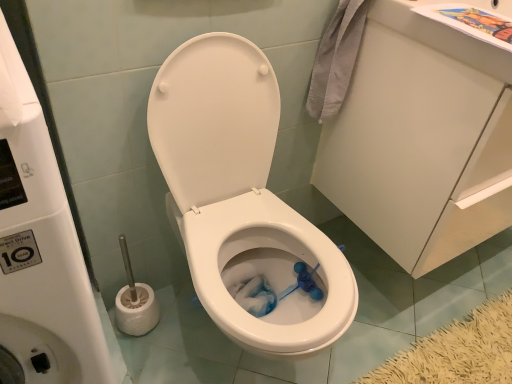
Question: From the image's perspective, is white glossy toilet at center located beneath white glossy water tank at upper center?

Choices:
 (A) no
 (B) yes

Answer: (A)

Question: Considering the relative sizes of white glossy toilet at center and white glossy water tank at upper center in the image provided, is white glossy toilet at center taller than white glossy water tank at upper center?

Choices:
 (A) no
 (B) yes

Answer: (A)

Question: Is white glossy toilet at center oriented away from white glossy water tank at upper center?

Choices:
 (A) no
 (B) yes

Answer: (A)

Question: Can we say white glossy toilet at center lies outside white glossy water tank at upper center?

Choices:
 (A) yes
 (B) no

Answer: (A)

Question: From the image's perspective, is white glossy toilet at center located above white glossy water tank at upper center?

Choices:
 (A) no
 (B) yes

Answer: (B)

Question: Considering the relative positions of white glossy cabinet at upper right and white glossy water tank at upper center in the image provided, is white glossy cabinet at upper right to the left or to the right of white glossy water tank at upper center?

Choices:
 (A) right
 (B) left

Answer: (A)

Question: Looking at the image, does white glossy cabinet at upper right seem bigger or smaller compared to white glossy water tank at upper center?

Choices:
 (A) small
 (B) big

Answer: (B)

Question: Considering their positions, is white glossy cabinet at upper right located in front of or behind white glossy water tank at upper center?

Choices:
 (A) front
 (B) behind

Answer: (B)

Question: From a real-world perspective, is white glossy cabinet at upper right above or below white glossy water tank at upper center?

Choices:
 (A) above
 (B) below

Answer: (A)

Question: Is white glossy water tank at upper center in front of or behind white glossy toilet at center in the image?

Choices:
 (A) front
 (B) behind

Answer: (A)

Question: In terms of height, does white glossy water tank at upper center look taller or shorter compared to white glossy toilet at center?

Choices:
 (A) tall
 (B) short

Answer: (A)

Question: In terms of width, does white glossy water tank at upper center look wider or thinner when compared to white glossy toilet at center?

Choices:
 (A) wide
 (B) thin

Answer: (A)

Question: From a real-world perspective, is white glossy water tank at upper center above or below white glossy toilet at center?

Choices:
 (A) above
 (B) below

Answer: (A)

Question: Considering the positions of point (245, 114) and point (61, 213), is point (245, 114) closer or farther from the camera than point (61, 213)?

Choices:
 (A) farther
 (B) closer

Answer: (A)

Question: From their relative heights in the image, would you say white glossy toilet at center is taller or shorter than white glossy water tank at upper center?

Choices:
 (A) tall
 (B) short

Answer: (B)